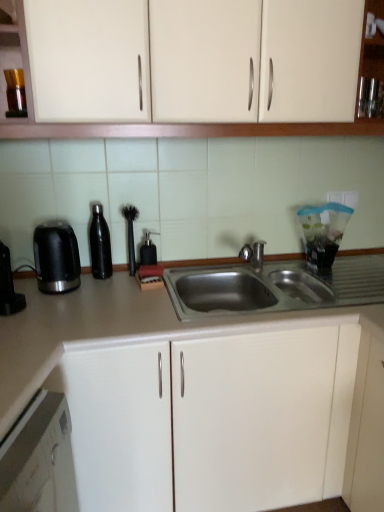
Question: Are black matte water bottle at left, which is the third appliance from right to left, and matte gray countertop at center far apart?

Choices:
 (A) no
 (B) yes

Answer: (A)

Question: Considering the relative sizes of black matte water bottle at left, which is counted as the first appliance, starting from the left, and matte gray countertop at center in the image provided, is black matte water bottle at left, which is counted as the first appliance, starting from the left, taller than matte gray countertop at center?

Choices:
 (A) yes
 (B) no

Answer: (B)

Question: Is black matte water bottle at left, which is counted as the first appliance, starting from the left, directly adjacent to matte gray countertop at center?

Choices:
 (A) no
 (B) yes

Answer: (A)

Question: From the image's perspective, is black matte water bottle at left, which is the third appliance from right to left, over matte gray countertop at center?

Choices:
 (A) no
 (B) yes

Answer: (B)

Question: Is matte gray countertop at center completely or partially inside black matte water bottle at left, which is counted as the first appliance, starting from the left?

Choices:
 (A) yes
 (B) no

Answer: (B)

Question: Is point [x=66, y=274] closer or farther from the camera than point [x=129, y=211]?

Choices:
 (A) closer
 (B) farther

Answer: (A)

Question: Would you say black plastic kettle at left is to the left or to the right of black rubber brush at center, arranged as the second appliance when viewed from the right, in the picture?

Choices:
 (A) right
 (B) left

Answer: (B)

Question: In the image, is black plastic kettle at left positioned in front of or behind black rubber brush at center, arranged as the second appliance when viewed from the right?

Choices:
 (A) front
 (B) behind

Answer: (A)

Question: Is black plastic kettle at left inside or outside of black rubber brush at center, arranged as the second appliance when viewed from the right?

Choices:
 (A) inside
 (B) outside

Answer: (B)

Question: Is point (379, 134) positioned closer to the camera than point (99, 271)?

Choices:
 (A) closer
 (B) farther

Answer: (A)

Question: Looking at their shapes, would you say matte white cabinets at upper center is wider or thinner than black matte water bottle at left, which is counted as the first appliance, starting from the left?

Choices:
 (A) thin
 (B) wide

Answer: (B)

Question: Is matte white cabinets at upper center bigger or smaller than black matte water bottle at left, which is the third appliance from right to left?

Choices:
 (A) big
 (B) small

Answer: (A)

Question: Considering the positions of matte white cabinets at upper center and black matte water bottle at left, which is counted as the first appliance, starting from the left, in the image, is matte white cabinets at upper center taller or shorter than black matte water bottle at left, which is counted as the first appliance, starting from the left,?

Choices:
 (A) short
 (B) tall

Answer: (B)

Question: Looking at the image, does black plastic kettle at left seem bigger or smaller compared to matte gray countertop at center?

Choices:
 (A) big
 (B) small

Answer: (B)

Question: From their relative heights in the image, would you say black plastic kettle at left is taller or shorter than matte gray countertop at center?

Choices:
 (A) short
 (B) tall

Answer: (A)